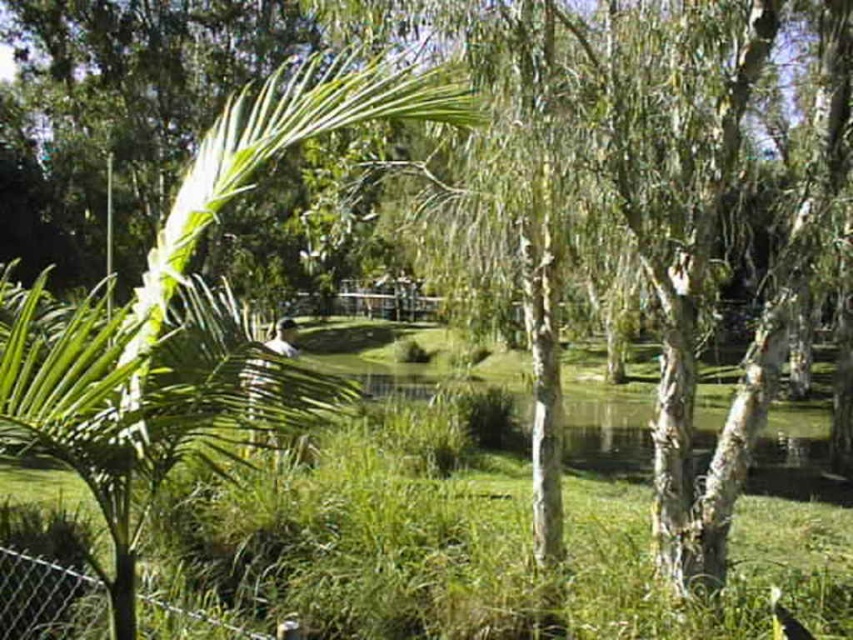
Is green leafy palm tree at left shorter than metal chain-link fence at lower left?

Incorrect, green leafy palm tree at left's height does not fall short of metal chain-link fence at lower left's.

Which is in front, point (212, 332) or point (38, 557)?

Point (212, 332) is in front.

In order to click on green leafy palm tree at left in this screenshot , I will do `click(187, 314)`.

Locate an element on the screen. The image size is (853, 640). green leafy palm tree at left is located at coordinates (187, 314).